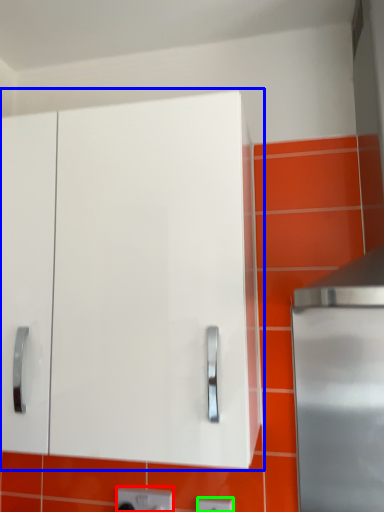
Question: Considering the real-world distances, which object is closest to electric outlet (highlighted by a red box)? cabinetry (highlighted by a blue box) or electric outlet (highlighted by a green box).

Choices:
 (A) cabinetry
 (B) electric outlet

Answer: (B)